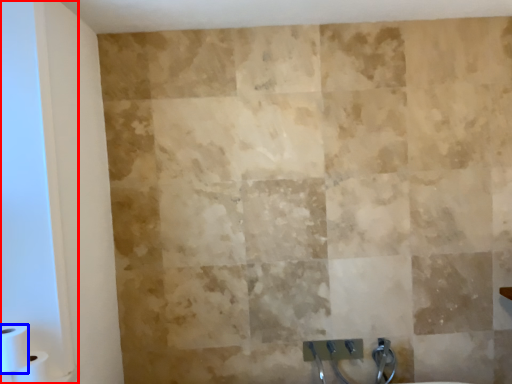
Question: Which object appears farthest to the camera in this image, glass door (highlighted by a red box) or toilet paper (highlighted by a blue box)?

Choices:
 (A) glass door
 (B) toilet paper

Answer: (B)